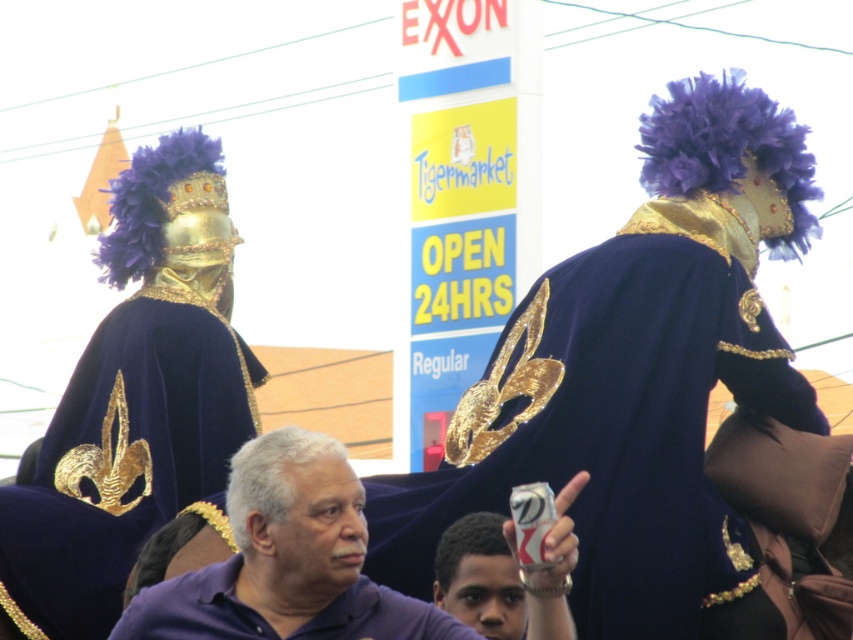
Is velvet dark blue robe at center further to the viewer compared to purple matte shirt at center?

Yes, velvet dark blue robe at center is further from the viewer.

Is point (503, 449) less distant than point (276, 634)?

No.

Which is in front, point (595, 317) or point (265, 614)?

Point (265, 614) is more forward.

Find the location of a particular element. This screenshot has height=640, width=853. velvet dark blue robe at center is located at coordinates (619, 422).

Can you confirm if velvet dark blue robe at center is smaller than purple velvet robe at center?

No, velvet dark blue robe at center is not smaller than purple velvet robe at center.

Is point (614, 509) farther from viewer compared to point (184, 627)?

Yes, point (614, 509) is farther from viewer.

Where is `velvet dark blue robe at center`? This screenshot has width=853, height=640. velvet dark blue robe at center is located at coordinates (619, 422).

Does purple matte shirt at center have a greater width compared to purple velvet robe at center?

Yes.

Is point (349, 500) positioned behind point (318, 636)?

Yes, it is.

At what (x,y) coordinates should I click in order to perform the action: click on purple matte shirt at center. Please return your answer as a coordinate pair (x, y). Looking at the image, I should click on [x=287, y=561].